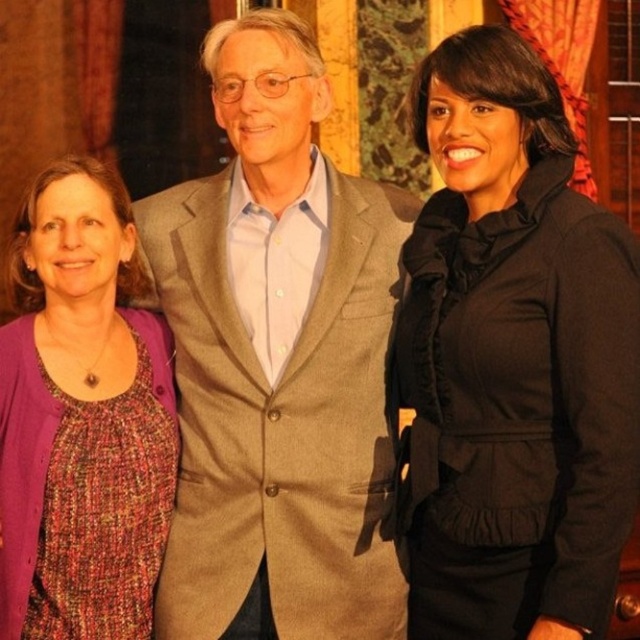
Question: Which object is positioned closest to the multicolored woven blouse at left?

Choices:
 (A) light brown wool suit at center
 (B) black satin jacket at right

Answer: (A)

Question: Where is black satin jacket at right located in relation to multicolored woven blouse at left in the image?

Choices:
 (A) above
 (B) below

Answer: (A)

Question: Which object appears farthest from the camera in this image?

Choices:
 (A) black satin jacket at right
 (B) multicolored woven blouse at left

Answer: (B)

Question: Does black satin jacket at right have a smaller size compared to multicolored woven blouse at left?

Choices:
 (A) yes
 (B) no

Answer: (B)

Question: Can you confirm if light brown wool suit at center is bigger than multicolored woven blouse at left?

Choices:
 (A) yes
 (B) no

Answer: (A)

Question: Which object is farther from the camera taking this photo?

Choices:
 (A) black satin jacket at right
 (B) light brown wool suit at center
 (C) multicolored woven blouse at left

Answer: (B)